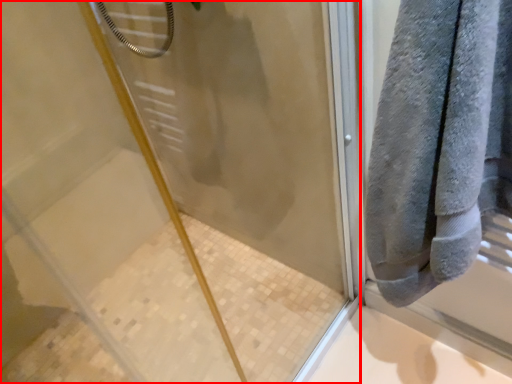
Question: From the image's perspective, what is the correct spatial relationship of screen door (annotated by the red box) in relation to towel?

Choices:
 (A) below
 (B) above

Answer: (A)